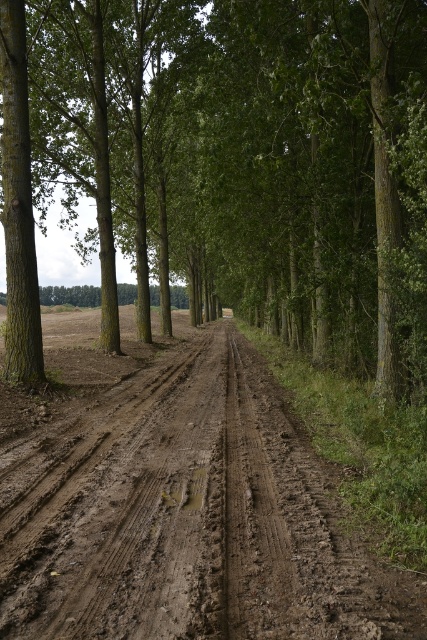
You are a hiker walking along the dirt road and want to reach the brown rough tree at center. Which direction should you walk to get closer to it without crossing the brown muddy dirt track at center?

The brown rough tree at center is closer to you than the brown muddy dirt track at center, so you should walk towards the tree without crossing the track.